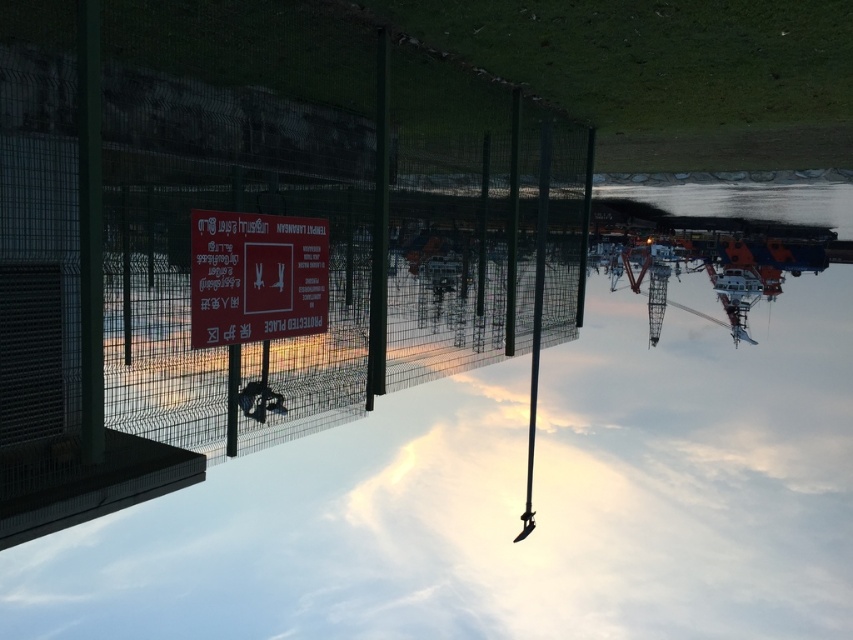
Question: Does green wire mesh fence at center lie behind matte red sign at center?

Choices:
 (A) yes
 (B) no

Answer: (B)

Question: Which point is farther to the camera?

Choices:
 (A) matte red sign at center
 (B) green wire mesh fence at center

Answer: (A)

Question: Does green wire mesh fence at center have a larger size compared to matte red sign at center?

Choices:
 (A) yes
 (B) no

Answer: (A)

Question: Observing the image, what is the correct spatial positioning of green wire mesh fence at center in reference to matte red sign at center?

Choices:
 (A) above
 (B) below

Answer: (B)

Question: Which point appears farthest from the camera in this image?

Choices:
 (A) (306, 285)
 (B) (521, 340)

Answer: (B)